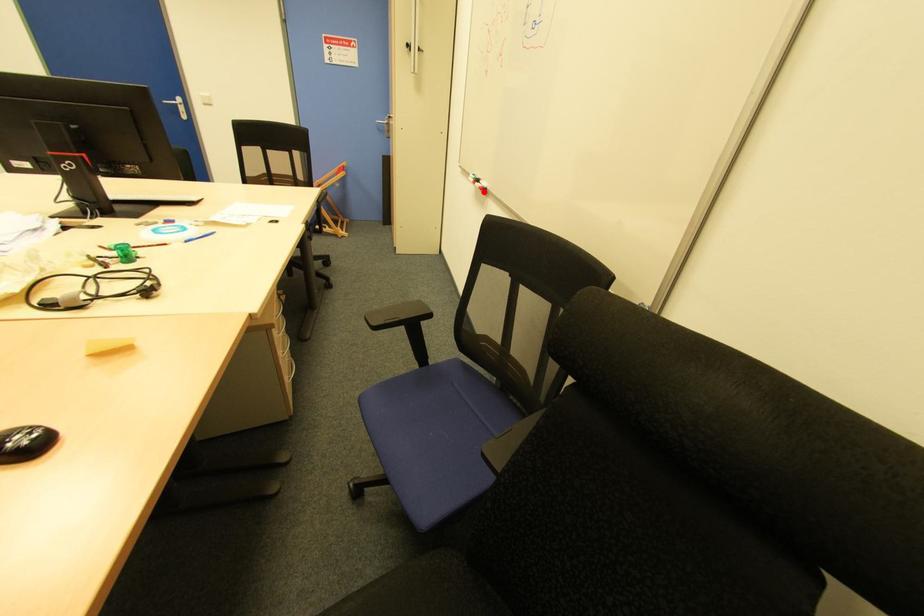
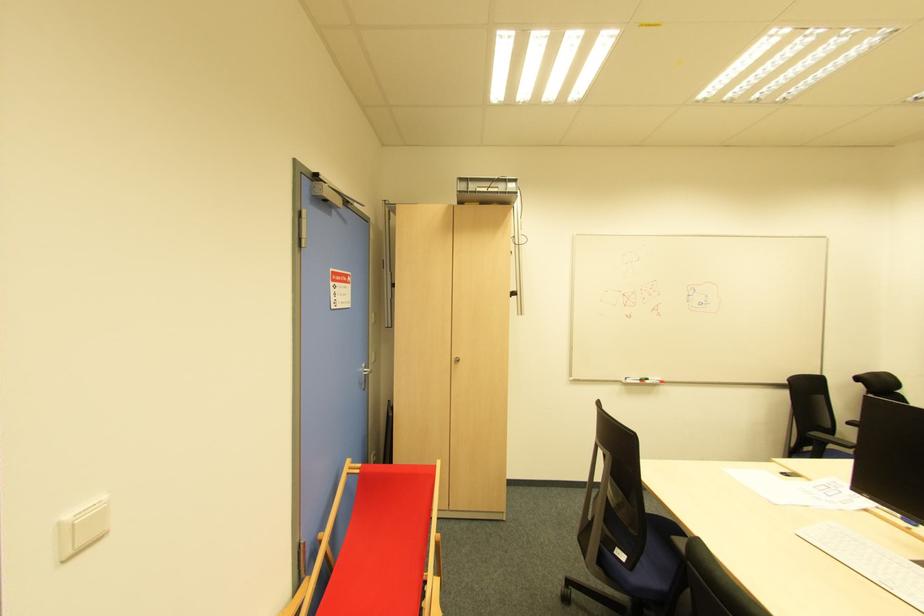
Question: I am providing you with two images of the same scene from different viewpoints. Given a red point in image1, look at the same physical point in image2. Is it:

Choices:
 (A) Closer to the viewpoint
 (B) Farther from the viewpoint

Answer: (B)